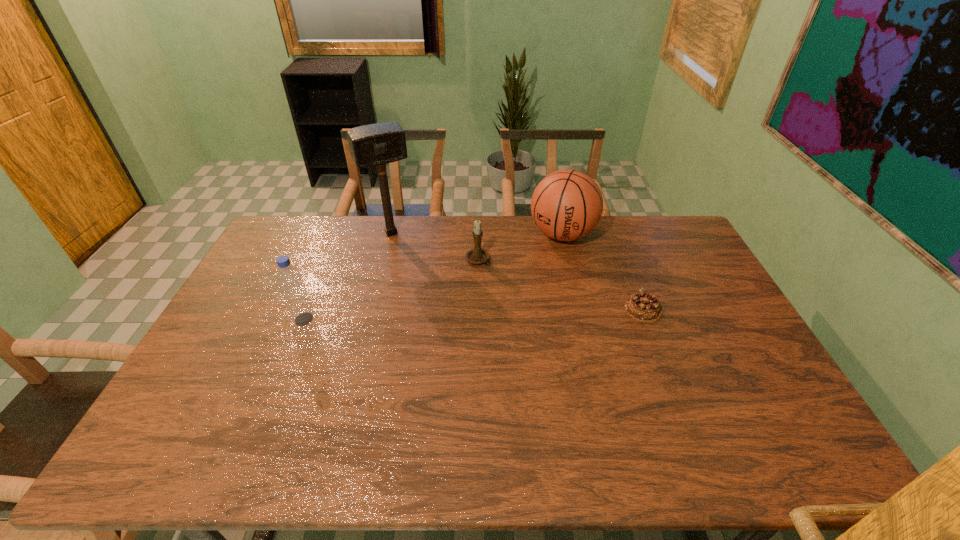
At what (x,y) coordinates should I click in order to perform the action: click on candle holder present at the far edge. Please return your answer as a coordinate pair (x, y). This screenshot has height=540, width=960. Looking at the image, I should click on (477, 255).

Image resolution: width=960 pixels, height=540 pixels. In order to click on basketball located at the far edge in this screenshot , I will do `click(566, 205)`.

Locate an element on the screen. The image size is (960, 540). free space at the far edge of the desktop is located at coordinates (481, 219).

The height and width of the screenshot is (540, 960). Find the location of `vacant space at the near edge of the desktop`. vacant space at the near edge of the desktop is located at coordinates (607, 410).

The width and height of the screenshot is (960, 540). In the image, there is a desktop. Identify the location of vacant space at the left edge. (271, 291).

At what (x,y) coordinates should I click in order to perform the action: click on vacant position at the right edge of the desktop. Please return your answer as a coordinate pair (x, y). This screenshot has height=540, width=960. Looking at the image, I should click on (693, 286).

Find the location of a particular element. Image resolution: width=960 pixels, height=540 pixels. vacant space at the far right corner of the desktop is located at coordinates (666, 236).

In the image, there is a desktop. At what (x,y) coordinates should I click in order to perform the action: click on vacant space at the near right corner. Please return your answer as a coordinate pair (x, y). This screenshot has width=960, height=540. Looking at the image, I should click on (789, 408).

The height and width of the screenshot is (540, 960). Identify the location of vacant space that is in between the chocolate cake and the second object from left to right. (x=517, y=271).

You are a GUI agent. You are given a task and a screenshot of the screen. Output one action in this format:
    pyautogui.click(x=<x>, y=<y>)
    Task: Click on the free area in between the tallest object and the second shortest object
    
    Given the screenshot: What is the action you would take?
    pyautogui.click(x=434, y=247)